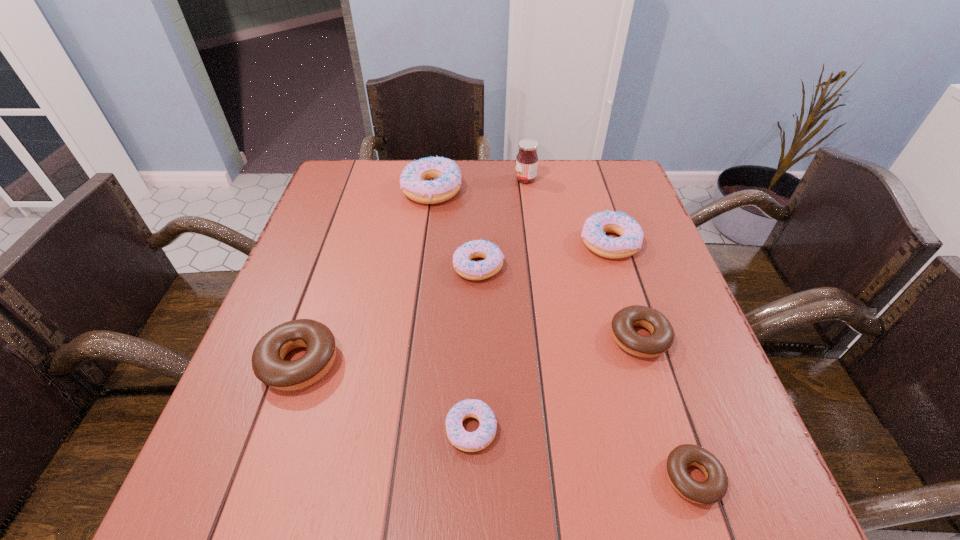
Image resolution: width=960 pixels, height=540 pixels. What are the coordinates of `the smallest brown doughnut` in the screenshot? It's located at (714, 488).

What are the coordinates of `blank area located 0.050m on the label side of the tallest object` in the screenshot? It's located at (498, 179).

The height and width of the screenshot is (540, 960). What are the coordinates of `vacant region located on the label side of the tallest object` in the screenshot? It's located at (389, 179).

You are a GUI agent. You are given a task and a screenshot of the screen. Output one action in this format:
    pyautogui.click(x=<x>, y=<y>)
    Task: Click on the vacant point located on the label side of the tallest object
    This screenshot has height=540, width=960.
    Given the screenshot: What is the action you would take?
    pyautogui.click(x=423, y=179)

What are the coordinates of `vacant space located 0.080m on the right of the second tallest object` in the screenshot? It's located at (490, 190).

You are a GUI agent. You are given a task and a screenshot of the screen. Output one action in this format:
    pyautogui.click(x=<x>, y=<y>)
    Task: Click on the free location located 0.220m on the front of the rightmost purple doughnut
    
    Given the screenshot: What is the action you would take?
    pyautogui.click(x=639, y=337)

The image size is (960, 540). I want to click on free spot located 0.170m on the front of the leftmost object, so click(253, 497).

Where is `free region located on the back of the third biggest purple doughnut`? free region located on the back of the third biggest purple doughnut is located at coordinates (479, 182).

This screenshot has height=540, width=960. Identify the location of vacant space positioned 0.400m on the left of the second smallest brown doughnut. (411, 338).

This screenshot has width=960, height=540. Find the location of `vacant area situated 0.150m on the right of the nearest purple doughnut`. vacant area situated 0.150m on the right of the nearest purple doughnut is located at coordinates (585, 429).